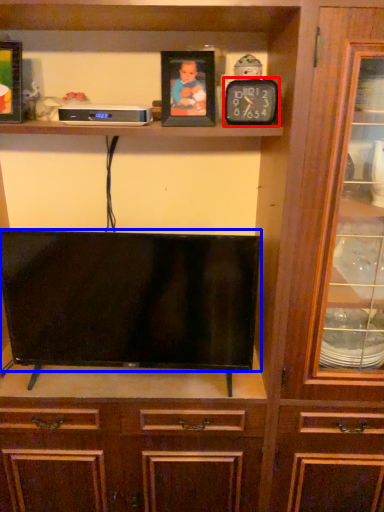
Question: Which object is further to the camera taking this photo, clock (highlighted by a red box) or television (highlighted by a blue box)?

Choices:
 (A) clock
 (B) television

Answer: (B)